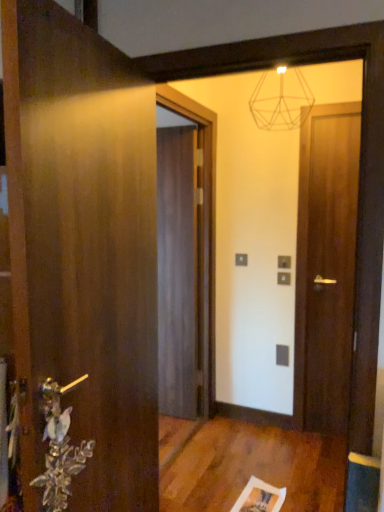
Question: Considering the positions of point (317, 128) and point (162, 285), is point (317, 128) closer or farther from the camera than point (162, 285)?

Choices:
 (A) farther
 (B) closer

Answer: (B)

Question: Based on their positions, is matte dark wood door at right, which is the 2th door in back-to-front order, located to the left or right of dark wood door at center, the second door positioned from the right?

Choices:
 (A) left
 (B) right

Answer: (B)

Question: Which of these objects is positioned closest to the silver metallic door handle at lower left?

Choices:
 (A) wooden door at left, the 3th door when ordered from back to front
 (B) matte dark wood door at right, which is the 2th door in back-to-front order
 (C) dark wood door at center, the second door positioned from the right

Answer: (A)

Question: Which of these objects is positioned closest to the silver metallic door handle at lower left?

Choices:
 (A) wooden door at left, the 1th door viewed from the front
 (B) matte dark wood door at right, which is the 2th door in back-to-front order
 (C) dark wood door at center, which is the third door in front-to-back order

Answer: (A)